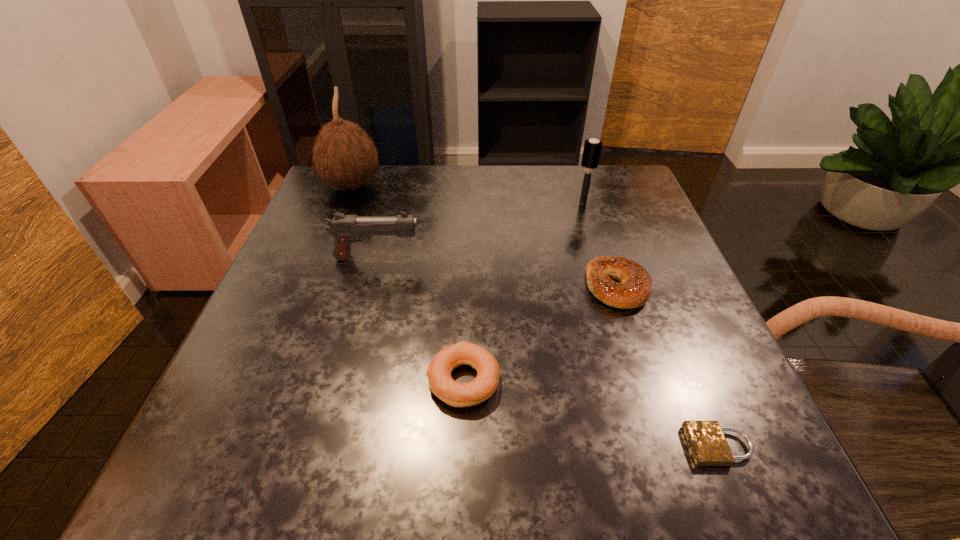
Image resolution: width=960 pixels, height=540 pixels. Identify the location of coconut. (344, 155).

Find the location of `the fifth shortest object`. the fifth shortest object is located at coordinates (592, 148).

This screenshot has width=960, height=540. Find the location of `gun`. gun is located at coordinates (345, 229).

Locate an element on the screen. This screenshot has height=540, width=960. the third tallest object is located at coordinates (345, 229).

Find the location of a particular element. The width and height of the screenshot is (960, 540). the farther bagel is located at coordinates pyautogui.click(x=634, y=290).

Find the location of `the right bagel`. the right bagel is located at coordinates (634, 290).

Identify the location of the second nearest object. [456, 394].

This screenshot has width=960, height=540. I want to click on the nearer bagel, so click(x=456, y=394).

Locate an element on the screen. The width and height of the screenshot is (960, 540). the shortest object is located at coordinates (707, 443).

Identify the location of the nearest object. (707, 443).